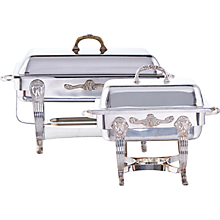
The width and height of the screenshot is (220, 220). Find the location of `candle holder / oil burner holder`. candle holder / oil burner holder is located at coordinates (150, 163).